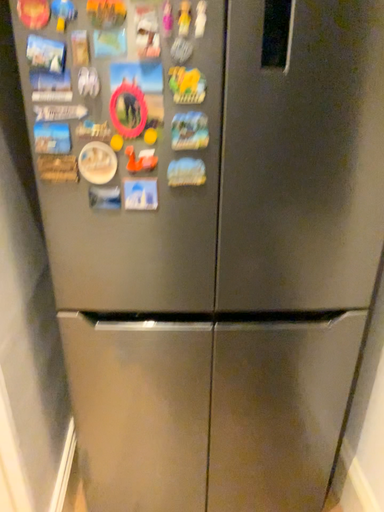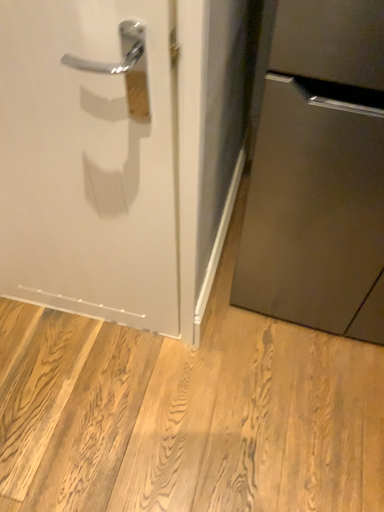
Question: How did the camera likely rotate when shooting the video?

Choices:
 (A) rotated left
 (B) rotated right

Answer: (A)